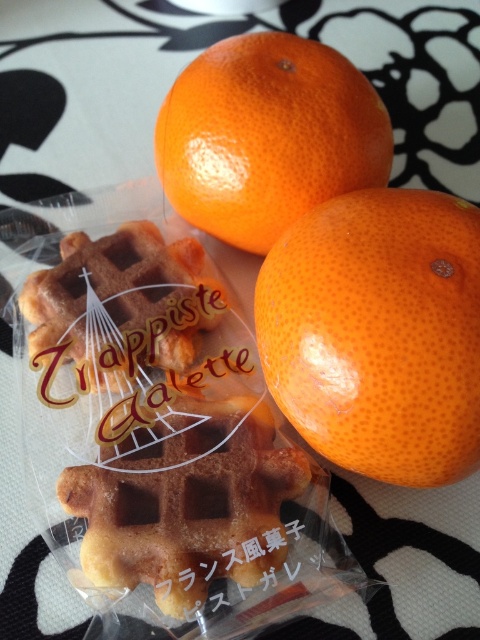
Question: Can you confirm if orangesmoothorange at right is wider than brown/crumbly waffle at center?

Choices:
 (A) yes
 (B) no

Answer: (A)

Question: Is glossy orange at upper center closer to camera compared to brown/crumbly waffle at center?

Choices:
 (A) no
 (B) yes

Answer: (B)

Question: Which object is positioned farthest from the golden brown waffle at center?

Choices:
 (A) brown/crumbly waffle at center
 (B) orangesmoothorange at right
 (C) glossy orange at upper center

Answer: (C)

Question: Which object is the farthest from the orangesmoothorange at right?

Choices:
 (A) glossy orange at upper center
 (B) brown/crumbly waffle at center

Answer: (B)

Question: Can you confirm if glossy orange at upper center is positioned above brown/crumbly waffle at center?

Choices:
 (A) no
 (B) yes

Answer: (B)

Question: Which is farther from the brown/crumbly waffle at center?

Choices:
 (A) glossy orange at upper center
 (B) golden brown waffle at center
 (C) orangesmoothorange at right

Answer: (C)